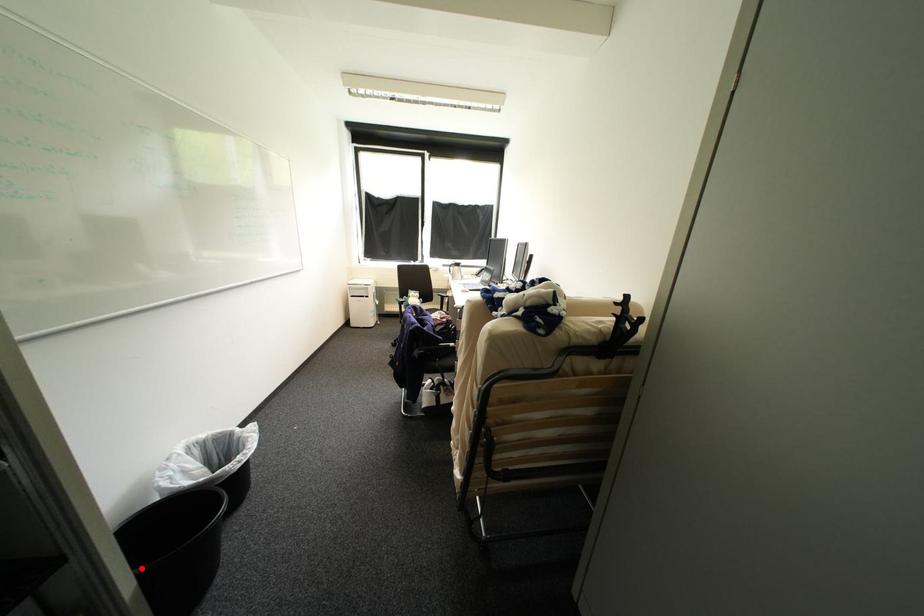
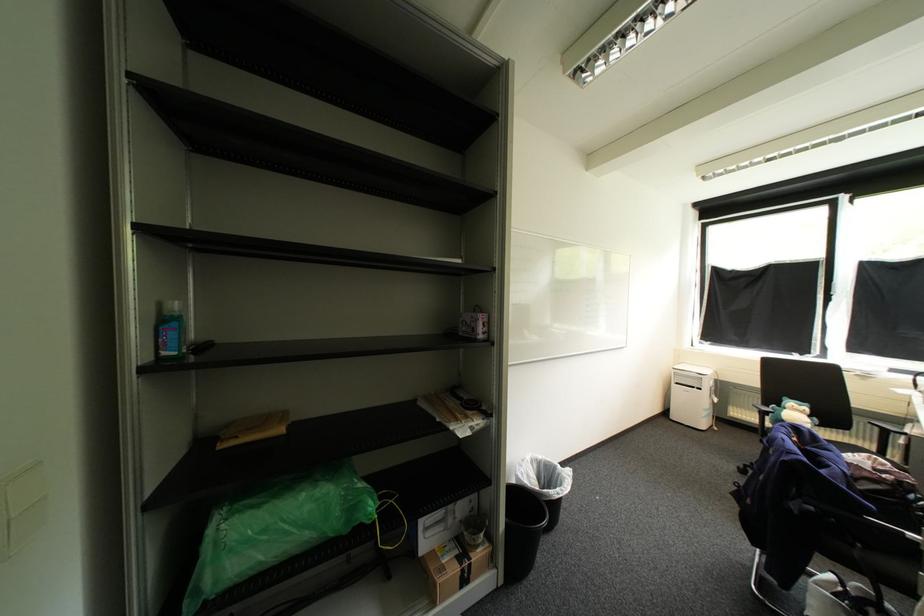
Question: A red point is marked in image1. In image2, is the corresponding 3D point closer to the camera or farther? Reply with the corresponding letter.

Choices:
 (A) The corresponding 3D point is closer.
 (B) The corresponding 3D point is farther.

Answer: (B)